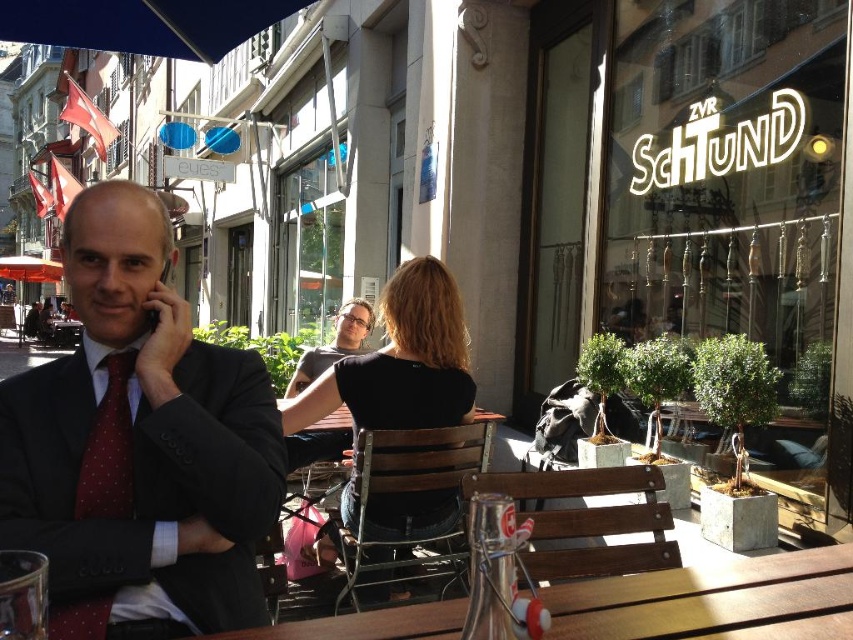
You are a customer at the outdoor cafe and want to order a drink. The barista asks you to point to the item you want from the menu. The menu is located on the wall behind the black fabric shirt at center and red dotted tie at left. Which object is closer to the menu so you can point more easily?

The black fabric shirt at center is positioned over the red dotted tie at left, so the black fabric shirt at center is closer to the menu on the wall behind them.

You are a photographer trying to capture both the matte black suit at center and the red dotted tie at left in a single frame. Since you want to ensure both are clearly visible, which object should you focus on first to account for their sizes?

The matte black suit at center is larger in size than the red dotted tie at left, so you should focus on the matte black suit at center first to ensure its details are sharp, as it occupies more space in the frame.

You are standing at the entrance of the outdoor cafe and want to find the matte black suit at center. According to the coordinates provided, in which direction should you look to locate it?

The matte black suit at center is located at point coordinates 0.697 on the x axis and 0.164 on the y axis. Since the x coordinate is closer to 1 than 0, it is to the right side of the image. The y coordinate is closer to 0, meaning it is lower down in the image. So you should look to the lower right direction to find the matte black suit at center.